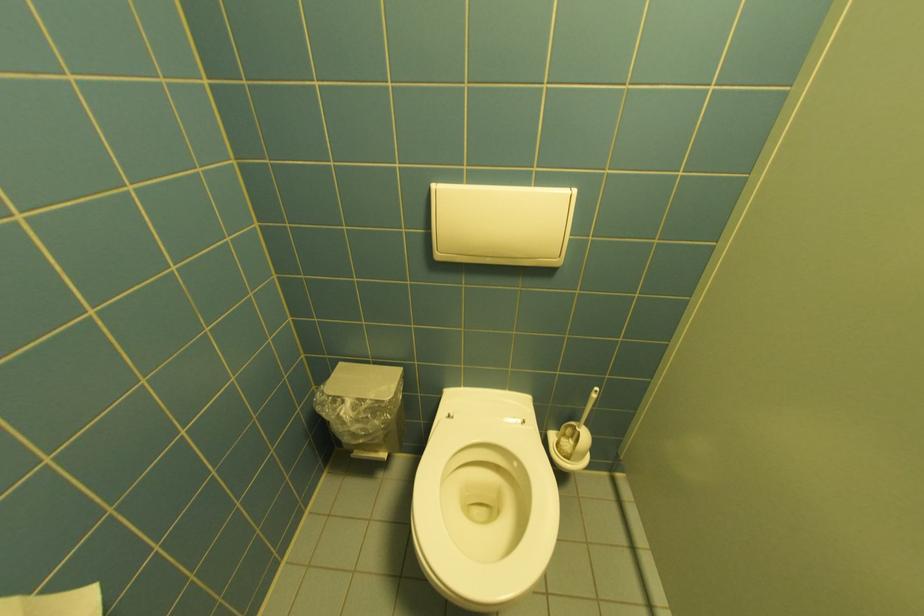
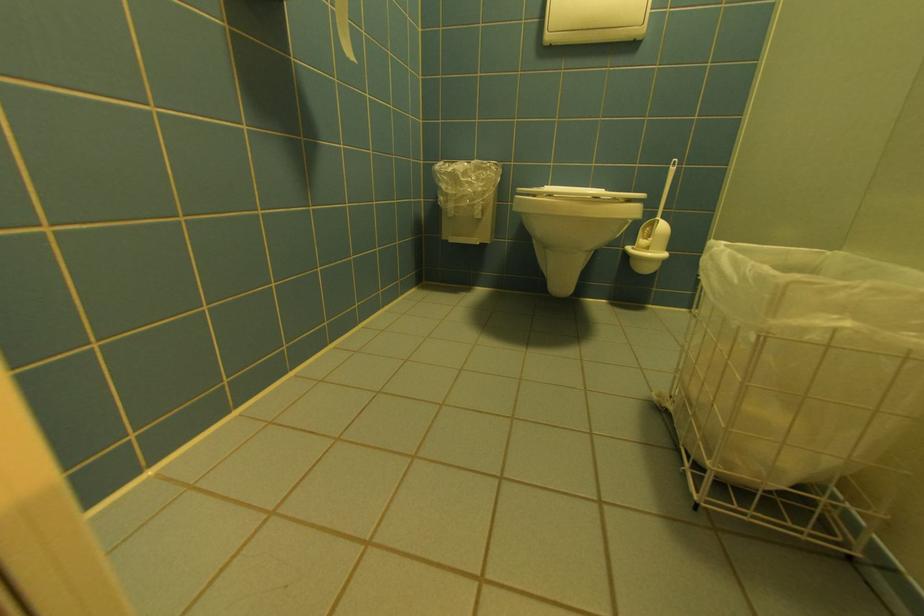
Which direction would the cameraman need to move to produce the second image?

The cameraman moved toward left, backward.